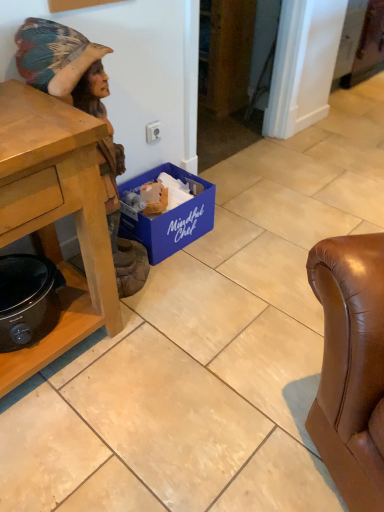
Question: From a real-world perspective, is black matte slow cooker at lower left over wooden statue at left?

Choices:
 (A) no
 (B) yes

Answer: (A)

Question: Can you confirm if black matte slow cooker at lower left is smaller than wooden statue at left?

Choices:
 (A) no
 (B) yes

Answer: (B)

Question: Considering the relative sizes of black matte slow cooker at lower left and wooden statue at left in the image provided, is black matte slow cooker at lower left taller than wooden statue at left?

Choices:
 (A) yes
 (B) no

Answer: (B)

Question: From a real-world perspective, is black matte slow cooker at lower left located beneath wooden statue at left?

Choices:
 (A) no
 (B) yes

Answer: (B)

Question: Is black matte slow cooker at lower left bigger than wooden statue at left?

Choices:
 (A) yes
 (B) no

Answer: (B)

Question: Considering the positions of black matte slow cooker at lower left and blue cardboard box at lower center in the image, is black matte slow cooker at lower left taller or shorter than blue cardboard box at lower center?

Choices:
 (A) short
 (B) tall

Answer: (A)

Question: Considering the positions of black matte slow cooker at lower left and blue cardboard box at lower center in the image, is black matte slow cooker at lower left bigger or smaller than blue cardboard box at lower center?

Choices:
 (A) small
 (B) big

Answer: (A)

Question: From the image's perspective, is black matte slow cooker at lower left above or below blue cardboard box at lower center?

Choices:
 (A) below
 (B) above

Answer: (A)

Question: Does point (11, 323) appear closer or farther from the camera than point (190, 211)?

Choices:
 (A) closer
 (B) farther

Answer: (A)

Question: From the image's perspective, relative to wooden statue at left, is black matte slow cooker at lower left above or below?

Choices:
 (A) below
 (B) above

Answer: (A)

Question: Is black matte slow cooker at lower left bigger or smaller than wooden statue at left?

Choices:
 (A) small
 (B) big

Answer: (A)

Question: Based on their positions, is black matte slow cooker at lower left located to the left or right of wooden statue at left?

Choices:
 (A) left
 (B) right

Answer: (A)

Question: Considering their positions, is black matte slow cooker at lower left located in front of or behind wooden statue at left?

Choices:
 (A) behind
 (B) front

Answer: (A)

Question: Is point (140, 258) positioned closer to the camera than point (130, 181)?

Choices:
 (A) closer
 (B) farther

Answer: (A)

Question: Considering the positions of wooden statue at left and blue cardboard box at lower center in the image, is wooden statue at left wider or thinner than blue cardboard box at lower center?

Choices:
 (A) thin
 (B) wide

Answer: (B)